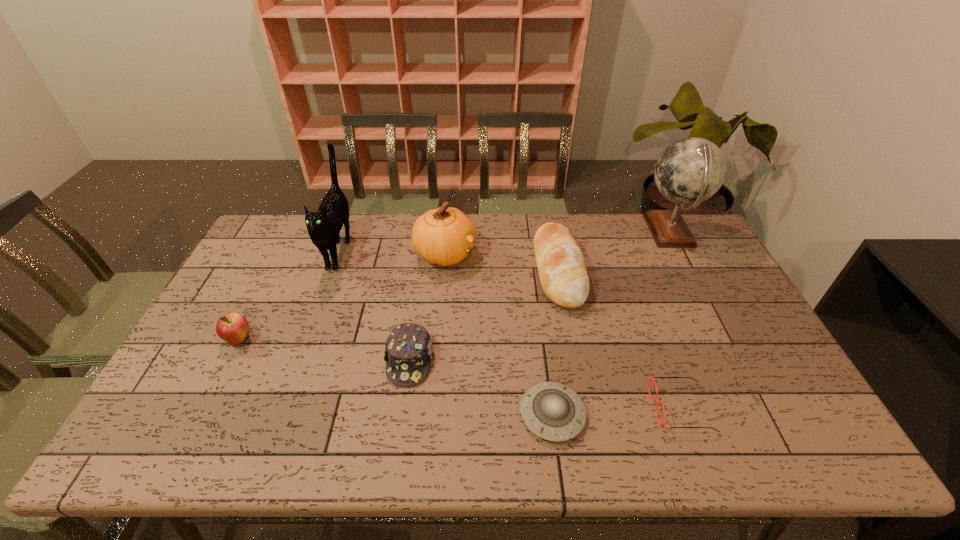
I want to click on free region located 0.090m at the equator of the rightmost object, so click(x=614, y=232).

The image size is (960, 540). Identify the location of vacant space located 0.270m at the equator of the rightmost object. (564, 232).

Find the location of `free spot located on the face of the cat`. free spot located on the face of the cat is located at coordinates (309, 333).

Identify the location of vacant area located 0.350m on the front face of the sixth shortest object. Image resolution: width=960 pixels, height=540 pixels. (579, 254).

Find the location of a particular element. vacant region located 0.120m on the front of the bread is located at coordinates (572, 346).

The image size is (960, 540). I want to click on vacant point located on the front of the apple, so click(190, 437).

Locate an element on the screen. vacant space situated 0.060m on the front-facing side of the sixth tallest object is located at coordinates (402, 409).

You are a GUI agent. You are given a task and a screenshot of the screen. Output one action in this format:
    pyautogui.click(x=<x>, y=<y>)
    Task: Click on the vacant region located on the front-facing side of the spectacles
    Image resolution: width=960 pixels, height=540 pixels.
    Given the screenshot: What is the action you would take?
    pyautogui.click(x=620, y=408)

The image size is (960, 540). Identify the location of vacant space positioned 0.290m on the front-facing side of the spectacles. (535, 408).

Where is `vacant space situated 0.390m on the front-facing side of the spectacles`? vacant space situated 0.390m on the front-facing side of the spectacles is located at coordinates (493, 408).